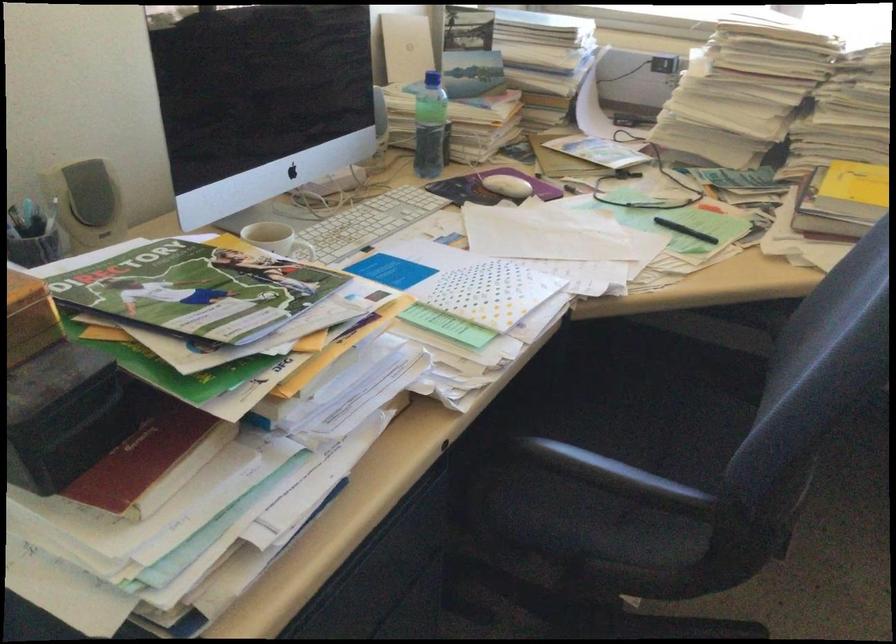
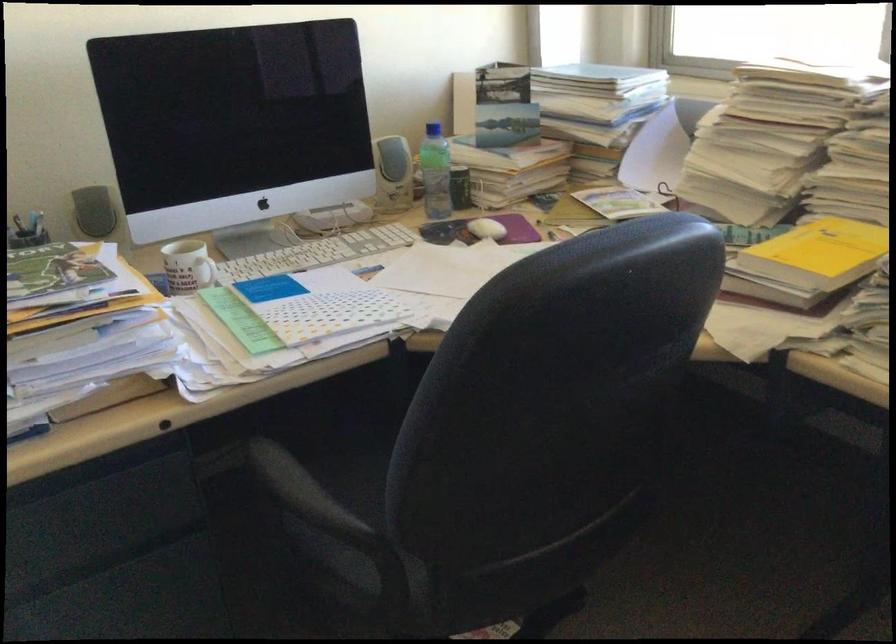
Where in the second image is the point corresponding to point 107,193 from the first image?

(93, 211)